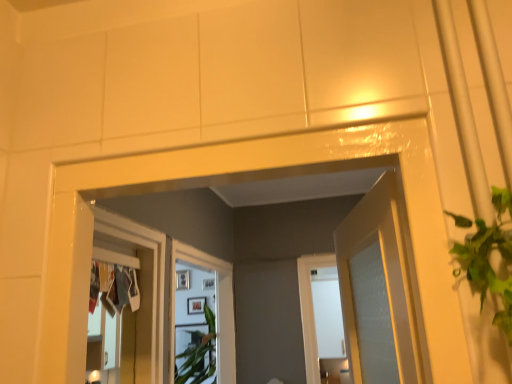
At what (x,y) coordinates should I click in order to perform the action: click on white glossy screen door at center. Please return your answer as a coordinate pair (x, y). Image resolution: width=512 pixels, height=384 pixels. Looking at the image, I should click on (217, 305).

What do you see at coordinates (217, 305) in the screenshot?
I see `white glossy screen door at center` at bounding box center [217, 305].

Identify the location of white glossy screen door at center. (217, 305).